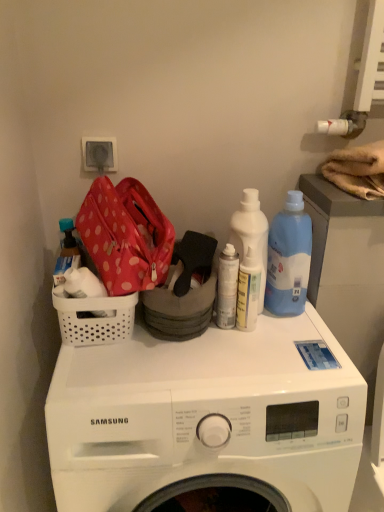
I want to click on blank area to the left of white matte spray can at center, the first bottle in the right-to-left sequence, so click(135, 352).